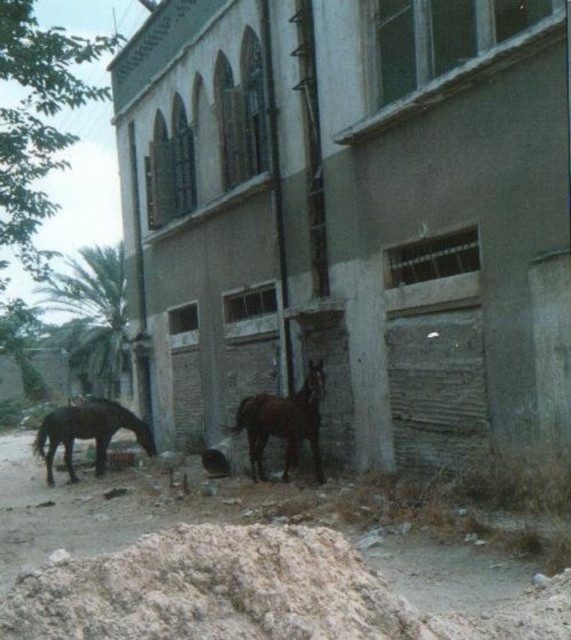
Based on the photo, is brown glossy horse at center in front of shiny dark brown horse at lower left?

Yes.

Does point (271, 397) come behind point (45, 440)?

No, (271, 397) is closer to viewer.

What do you see at coordinates (283, 422) in the screenshot? The image size is (571, 640). I see `brown glossy horse at center` at bounding box center [283, 422].

At what (x,y) coordinates should I click in order to perform the action: click on brown glossy horse at center. Please return your answer as a coordinate pair (x, y). Image resolution: width=571 pixels, height=640 pixels. Looking at the image, I should click on (283, 422).

Is light brown sandy mound at lower center further to camera compared to brown glossy horse at center?

No, it is not.

Is light brown sandy mound at lower center to the left of brown glossy horse at center from the viewer's perspective?

Indeed, light brown sandy mound at lower center is positioned on the left side of brown glossy horse at center.

Which is behind, point (258, 572) or point (286, 440)?

The point (286, 440) is behind.

The height and width of the screenshot is (640, 571). I want to click on light brown sandy mound at lower center, so click(x=212, y=589).

Is point (325, 531) behind point (321, 477)?

That is False.

Where is `brown dirt at lower center`? This screenshot has width=571, height=640. brown dirt at lower center is located at coordinates (243, 576).